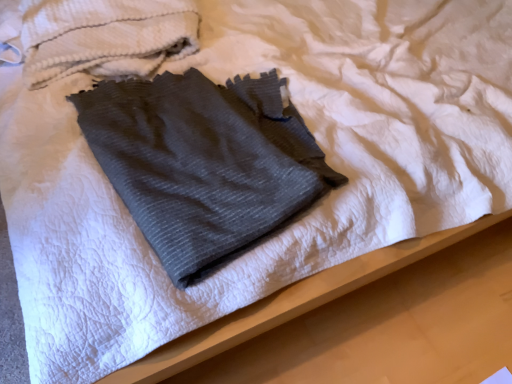
Question: Which direction should I rotate to face gray ribbed towel at center, the second towel positioned from the top, — up or down?

Choices:
 (A) up
 (B) down

Answer: (A)

Question: Should I look upward or downward to see white textured towel at upper left, the 2th towel from the bottom?

Choices:
 (A) up
 (B) down

Answer: (A)

Question: Does white textured towel at upper left, positioned as the 1th towel in top-to-bottom order, have a lesser height compared to gray ribbed towel at center, the second towel positioned from the top?

Choices:
 (A) no
 (B) yes

Answer: (A)

Question: Is white textured towel at upper left, positioned as the 1th towel in top-to-bottom order, to the right of gray ribbed towel at center, the first towel from the bottom, from the viewer's perspective?

Choices:
 (A) yes
 (B) no

Answer: (B)

Question: Does white textured towel at upper left, the 2th towel from the bottom, have a lesser width compared to gray ribbed towel at center, the first towel from the bottom?

Choices:
 (A) yes
 (B) no

Answer: (B)

Question: From the image's perspective, is white textured towel at upper left, positioned as the 1th towel in top-to-bottom order, beneath gray ribbed towel at center, the second towel positioned from the top?

Choices:
 (A) no
 (B) yes

Answer: (A)

Question: Can you confirm if white textured towel at upper left, positioned as the 1th towel in top-to-bottom order, is taller than gray ribbed towel at center, the second towel positioned from the top?

Choices:
 (A) no
 (B) yes

Answer: (B)

Question: Is white textured towel at upper left, positioned as the 1th towel in top-to-bottom order, positioned in front of gray ribbed towel at center, the first towel from the bottom?

Choices:
 (A) yes
 (B) no

Answer: (B)

Question: Can you confirm if gray ribbed towel at center, the first towel from the bottom, is thinner than white textured towel at upper left, positioned as the 1th towel in top-to-bottom order?

Choices:
 (A) yes
 (B) no

Answer: (A)

Question: Does gray ribbed towel at center, the first towel from the bottom, have a lesser height compared to white textured towel at upper left, the 2th towel from the bottom?

Choices:
 (A) yes
 (B) no

Answer: (A)

Question: Considering the relative sizes of gray ribbed towel at center, the first towel from the bottom, and white textured towel at upper left, positioned as the 1th towel in top-to-bottom order, in the image provided, is gray ribbed towel at center, the first towel from the bottom, smaller than white textured towel at upper left, positioned as the 1th towel in top-to-bottom order,?

Choices:
 (A) yes
 (B) no

Answer: (B)

Question: Is gray ribbed towel at center, the second towel positioned from the top, outside white textured towel at upper left, the 2th towel from the bottom?

Choices:
 (A) no
 (B) yes

Answer: (B)

Question: Is there a large distance between gray ribbed towel at center, the first towel from the bottom, and white textured towel at upper left, the 2th towel from the bottom?

Choices:
 (A) yes
 (B) no

Answer: (B)

Question: From a real-world perspective, is gray ribbed towel at center, the first towel from the bottom, positioned under white textured towel at upper left, the 2th towel from the bottom, based on gravity?

Choices:
 (A) yes
 (B) no

Answer: (A)

Question: From the image's perspective, is gray ribbed towel at center, the first towel from the bottom, positioned above or below white textured towel at upper left, the 2th towel from the bottom?

Choices:
 (A) above
 (B) below

Answer: (B)